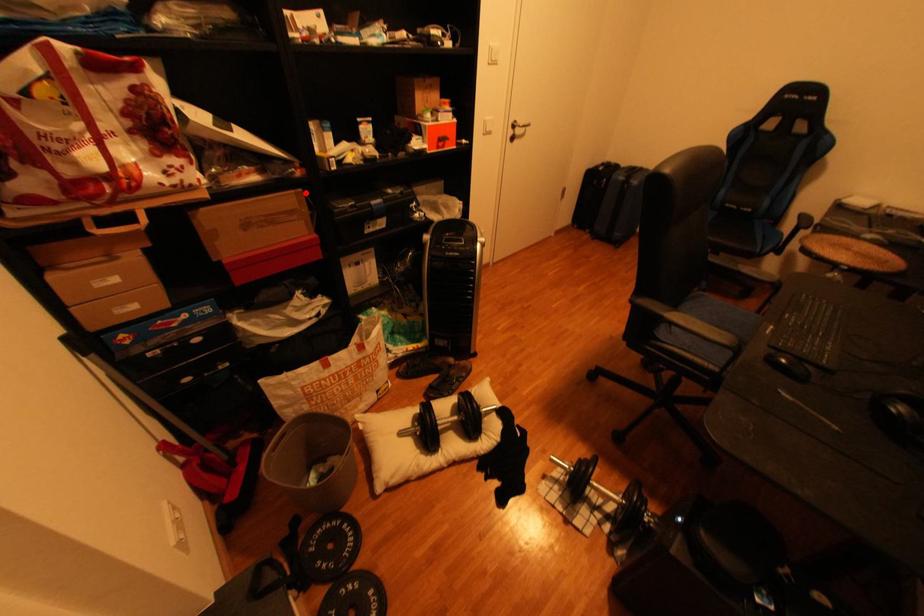
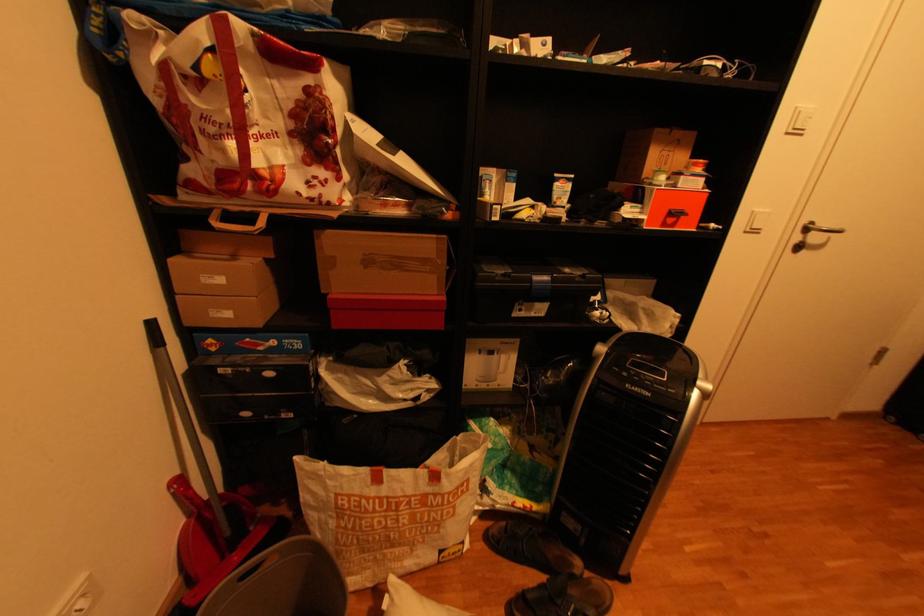
Find the pixel in the second image that matches the highlighted location in the first image.

(446, 238)